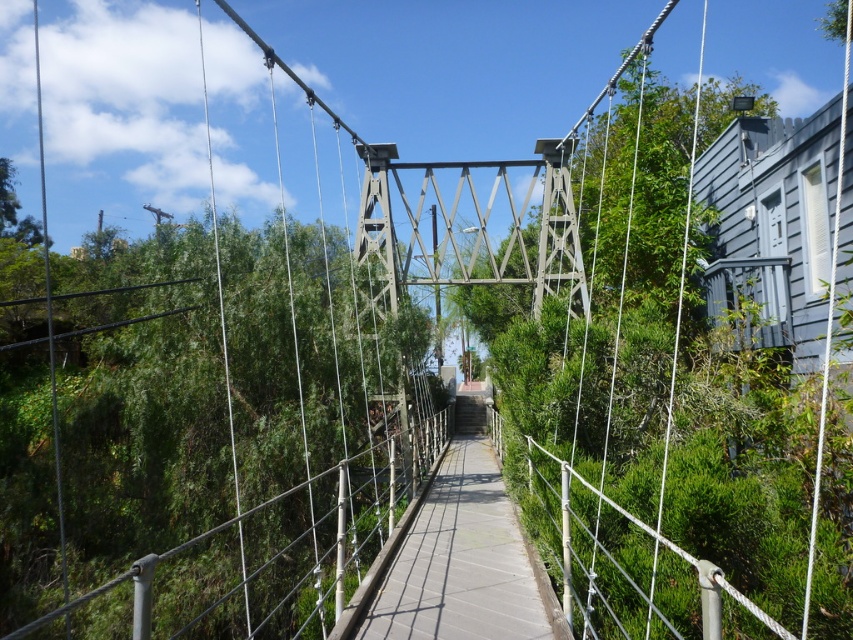
In the scene shown: Can you confirm if green leafy tree at center is positioned to the right of concrete walkway at center?

In fact, green leafy tree at center is to the left of concrete walkway at center.

Who is higher up, green leafy tree at center or concrete walkway at center?

Positioned higher is green leafy tree at center.

Between point (373, 346) and point (421, 586), which one is positioned in front?

Point (421, 586)

The width and height of the screenshot is (853, 640). What are the coordinates of `green leafy tree at center` in the screenshot? It's located at (213, 445).